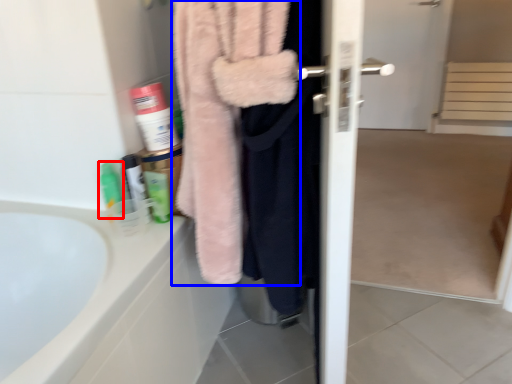
Question: Which object is further to the camera taking this photo, toiletry (highlighted by a red box) or towel (highlighted by a blue box)?

Choices:
 (A) toiletry
 (B) towel

Answer: (A)